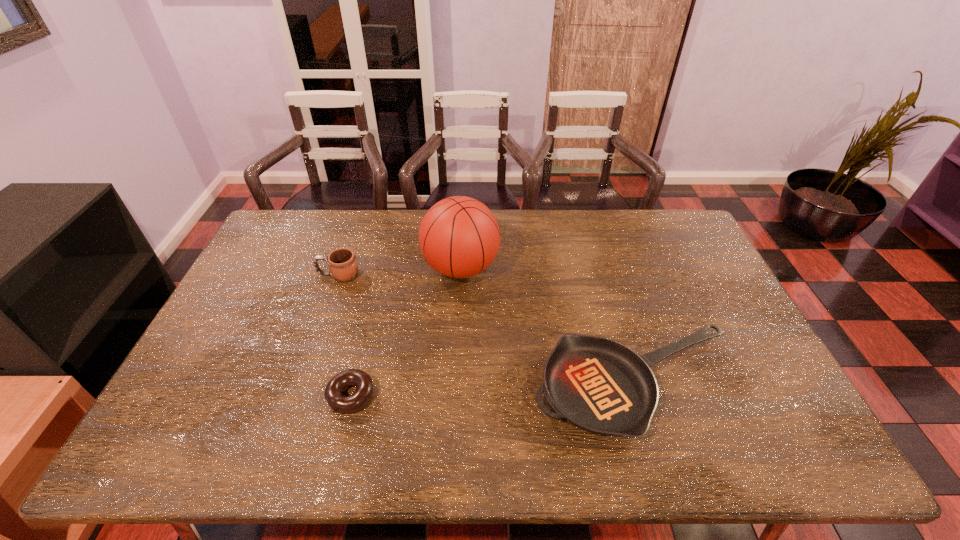
You are a GUI agent. You are given a task and a screenshot of the screen. Output one action in this format:
    pyautogui.click(x=<x>, y=<y>)
    Task: Click on the vacant space positioned 0.190m on the left of the frying pan
    
    Given the screenshot: What is the action you would take?
    pyautogui.click(x=459, y=384)

Find the location of `free space located 0.250m on the right of the doughnut`. free space located 0.250m on the right of the doughnut is located at coordinates (473, 395).

You are a GUI agent. You are given a task and a screenshot of the screen. Output one action in this format:
    pyautogui.click(x=<x>, y=<y>)
    Task: Click on the object at the far edge
    The image size is (960, 540).
    Given the screenshot: What is the action you would take?
    pyautogui.click(x=459, y=237)

This screenshot has height=540, width=960. I want to click on object that is at the near edge, so click(x=601, y=386).

The height and width of the screenshot is (540, 960). I want to click on object that is positioned at the right edge, so click(x=601, y=386).

Where is `object at the near right corner`? The height and width of the screenshot is (540, 960). object at the near right corner is located at coordinates (601, 386).

Where is `vacant region at the far edge of the desktop`? The width and height of the screenshot is (960, 540). vacant region at the far edge of the desktop is located at coordinates (390, 214).

Identify the location of free region at the near edge. This screenshot has width=960, height=540. (426, 451).

Locate an element on the screen. The image size is (960, 540). free space at the left edge of the desktop is located at coordinates (243, 316).

Where is `vacant space at the right edge of the desktop`? This screenshot has width=960, height=540. vacant space at the right edge of the desktop is located at coordinates (791, 408).